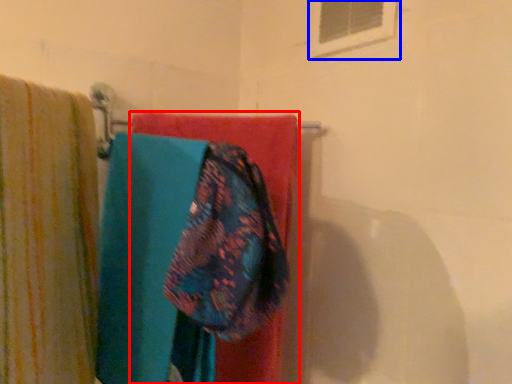
Question: Which point is closer to the camera, towel (highlighted by a red box) or window (highlighted by a blue box)?

Choices:
 (A) towel
 (B) window

Answer: (A)